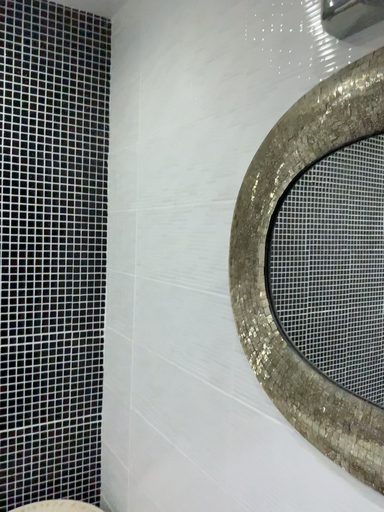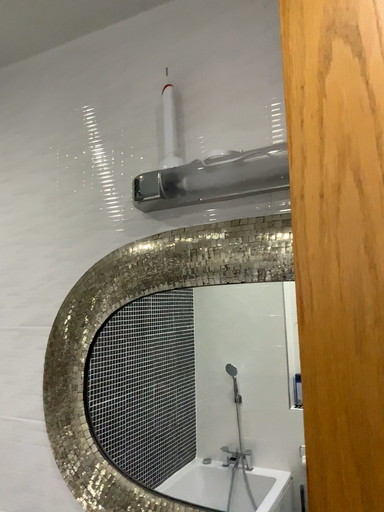
Question: How did the camera likely rotate when shooting the video?

Choices:
 (A) rotated right
 (B) rotated left

Answer: (A)